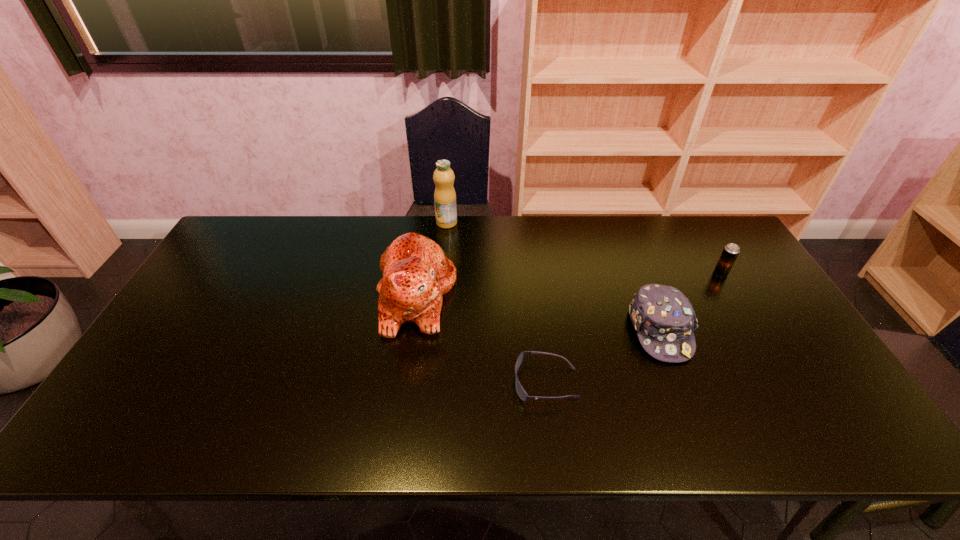
Find the location of `free spot at the far left corner of the desktop`. free spot at the far left corner of the desktop is located at coordinates pos(250,230).

This screenshot has width=960, height=540. I want to click on vacant area at the far right corner, so click(725, 238).

I want to click on empty space between the fourth object from left to right and the cat, so click(x=539, y=313).

This screenshot has height=540, width=960. What are the coordinates of `vacant space that is in between the cat and the rightmost object` in the screenshot? It's located at (x=568, y=284).

At what (x,y) coordinates should I click in order to perform the action: click on vacant space that's between the headwear and the cat. Please return your answer as a coordinate pair (x, y). The height and width of the screenshot is (540, 960). Looking at the image, I should click on (539, 313).

This screenshot has width=960, height=540. I want to click on free spot between the second object from right to left and the third object from right to left, so click(603, 356).

Locate an element on the screen. free spot between the fruit juice and the third object from right to left is located at coordinates (496, 303).

This screenshot has height=540, width=960. I want to click on free space between the headwear and the beer can, so click(x=690, y=301).

Find the location of a particular element. vacant area that lies between the third object from left to right and the cat is located at coordinates (481, 339).

Locate an element on the screen. The height and width of the screenshot is (540, 960). free area in between the beer can and the headwear is located at coordinates (690, 301).